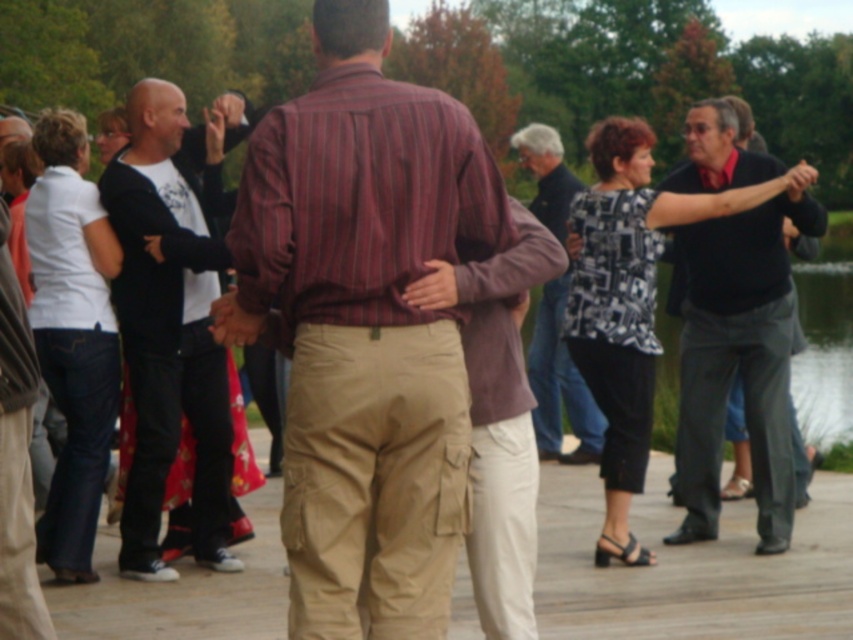
Is black cotton shirt at left positioned behind khaki cargo pants at center?

Yes, black cotton shirt at left is further from the viewer.

Can you confirm if black cotton shirt at left is taller than khaki cargo pants at center?

Yes, black cotton shirt at left is taller than khaki cargo pants at center.

Is point (142, 458) behind point (502, 580)?

Yes, point (142, 458) is farther from viewer.

Where is `black cotton shirt at left`? Image resolution: width=853 pixels, height=640 pixels. black cotton shirt at left is located at coordinates (169, 326).

Who is higher up, striped cotton shirt at center or black cotton shirt at left?

striped cotton shirt at center

Between striped cotton shirt at center and black cotton shirt at left, which one is positioned lower?

black cotton shirt at left is lower down.

Does point (312, 515) come closer to viewer compared to point (219, 140)?

Yes.

The width and height of the screenshot is (853, 640). What are the coordinates of `striped cotton shirt at center` in the screenshot? It's located at (364, 326).

How far apart are dark gray pants at right and khaki cargo pants at center?

dark gray pants at right is 3.35 meters from khaki cargo pants at center.

The image size is (853, 640). What do you see at coordinates (738, 360) in the screenshot?
I see `dark gray pants at right` at bounding box center [738, 360].

What do you see at coordinates (738, 360) in the screenshot? The width and height of the screenshot is (853, 640). I see `dark gray pants at right` at bounding box center [738, 360].

Locate an element on the screen. The width and height of the screenshot is (853, 640). dark gray pants at right is located at coordinates (738, 360).